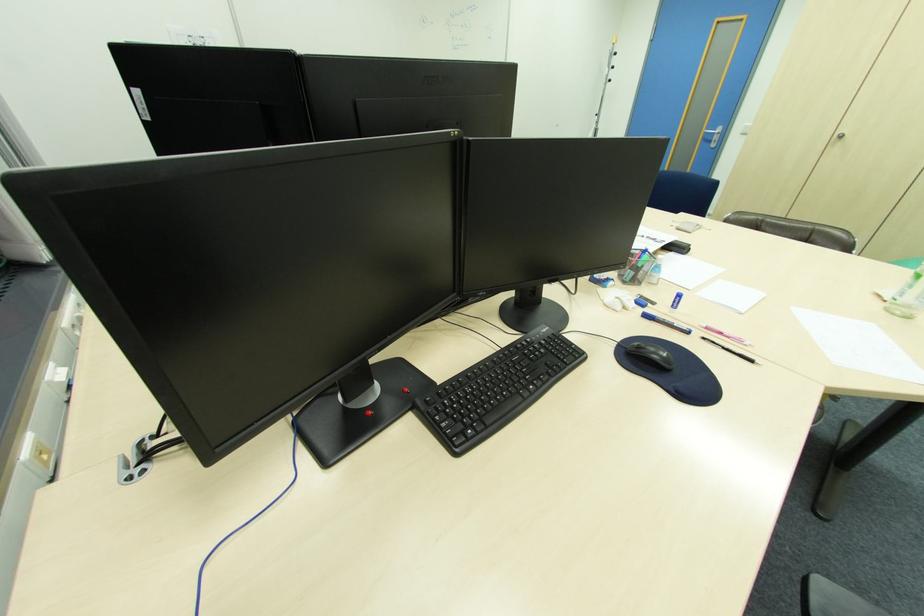
Where would you pull the metal door handle? Please return your answer as a coordinate pair (x, y).

(713, 136)